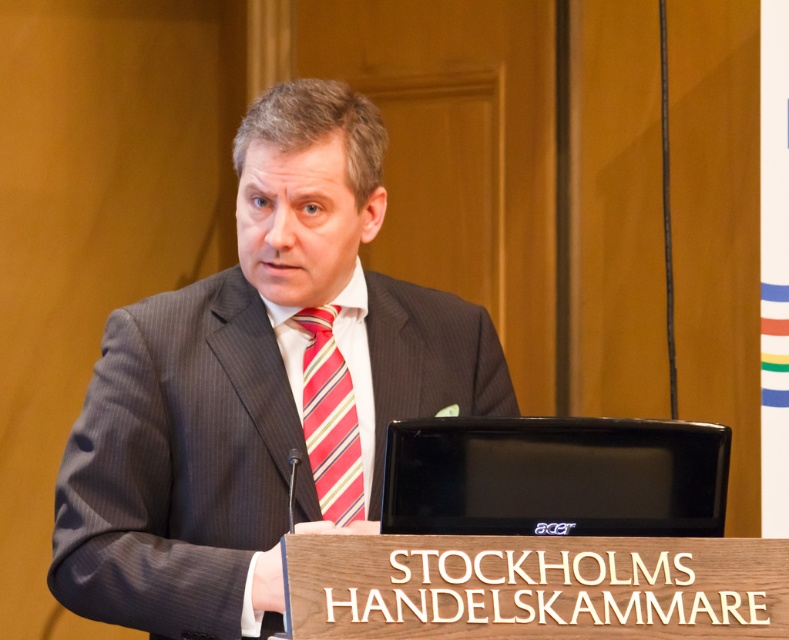
You are a photographer standing at a distance. You want to take a photo of the dark gray pinstripe suit at center. What is the minimum distance you need to be from the camera to ensure the suit is in focus?

The dark gray pinstripe suit at center is 5.30 feet from the camera, so you need to be at least 5.30 feet away from the camera to ensure the suit is in focus.